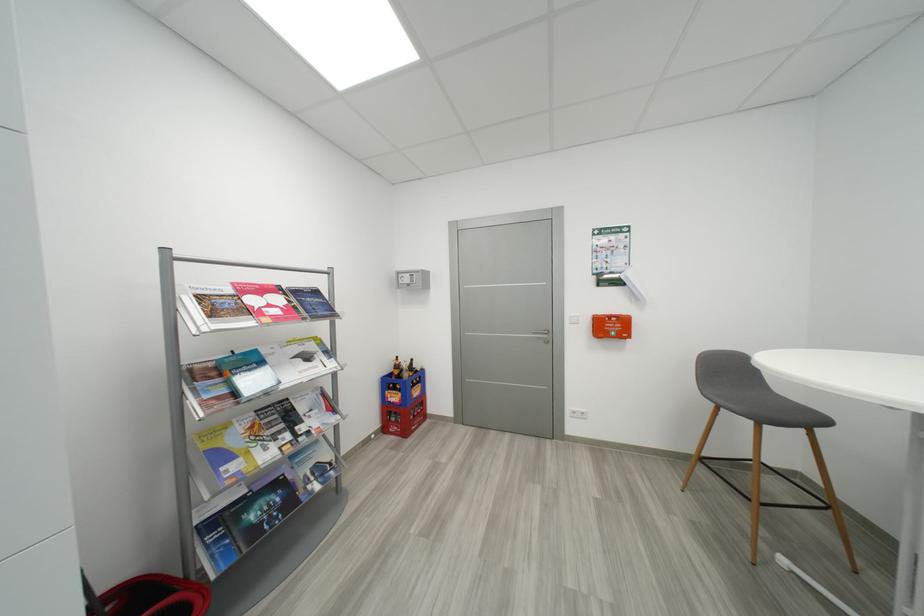
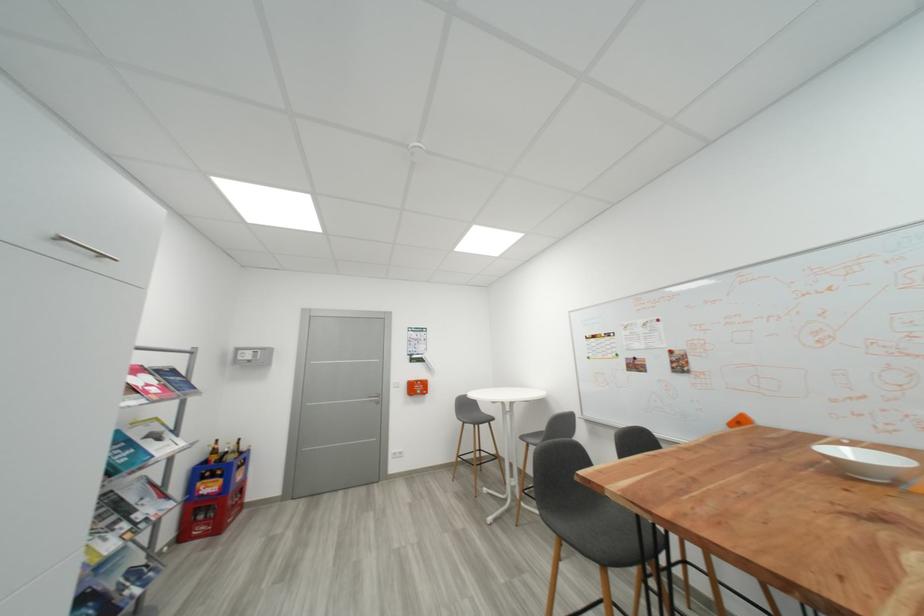
The point at (x=553, y=344) is marked in the first image. Where is the corresponding point in the second image?

(383, 405)